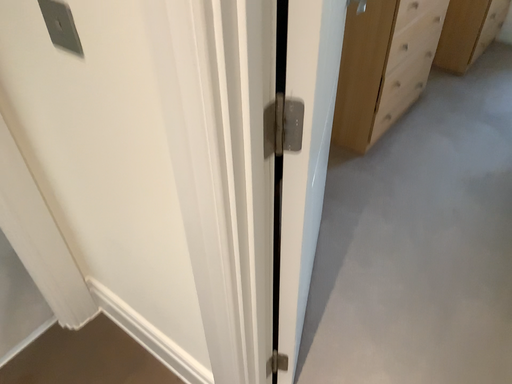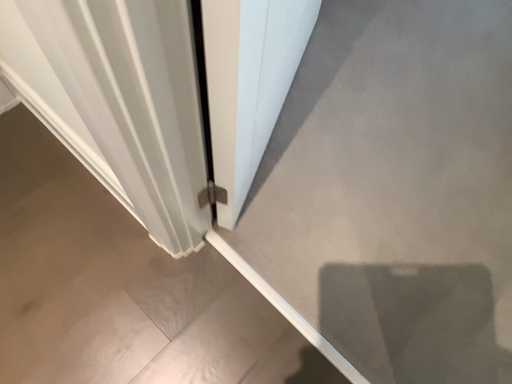
Question: Which way did the camera rotate in the video?

Choices:
 (A) rotated downward
 (B) rotated upward

Answer: (A)